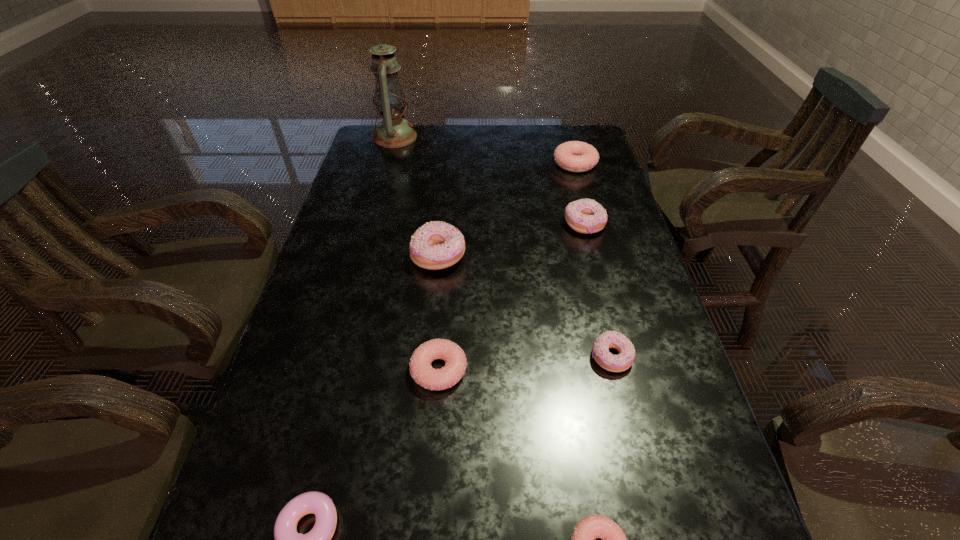
Image resolution: width=960 pixels, height=540 pixels. I want to click on the farthest object, so click(390, 100).

At what (x,y) coordinates should I click in order to perform the action: click on the tallest object. Please return your answer as a coordinate pair (x, y). Looking at the image, I should click on (390, 100).

Where is `the seventh shortest object`? This screenshot has width=960, height=540. the seventh shortest object is located at coordinates (436, 245).

Locate an element on the screen. The height and width of the screenshot is (540, 960). the second purple doughnut from left to right is located at coordinates (436, 245).

Where is `the second biggest purple doughnut`? This screenshot has width=960, height=540. the second biggest purple doughnut is located at coordinates (586, 216).

At what (x,y) coordinates should I click in order to perform the action: click on the farthest pink doughnut. Please return your answer as a coordinate pair (x, y). Looking at the image, I should click on (574, 156).

In order to click on the rightmost pink doughnut in this screenshot , I will do `click(574, 156)`.

Where is `the second nearest purple doughnut`? This screenshot has width=960, height=540. the second nearest purple doughnut is located at coordinates (610, 339).

Locate an element on the screen. Image resolution: width=960 pixels, height=540 pixels. the leftmost pink doughnut is located at coordinates pyautogui.click(x=421, y=371).

Where is `the second nearest pink doughnut`? This screenshot has height=540, width=960. the second nearest pink doughnut is located at coordinates (421, 371).